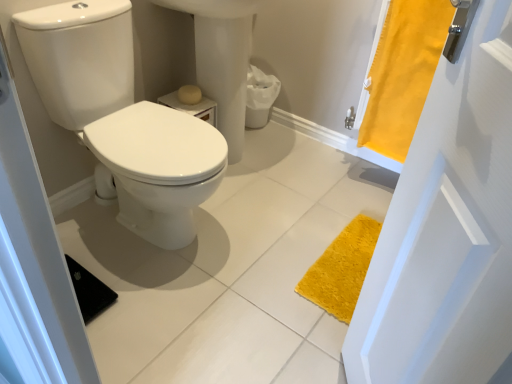
The width and height of the screenshot is (512, 384). Find the location of `free space below white glossy toilet at left (from a real-world perspective)`. free space below white glossy toilet at left (from a real-world perspective) is located at coordinates (155, 239).